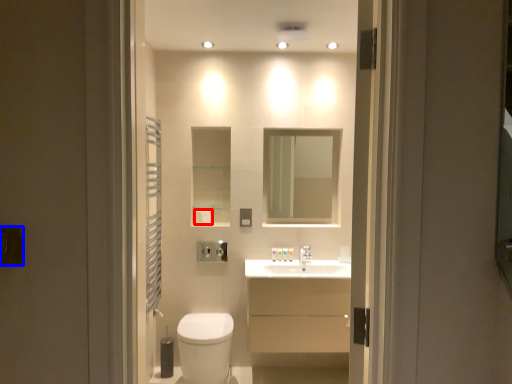
Question: Which point is further to the camera, toilet paper (highlighted by a red box) or electric outlet (highlighted by a blue box)?

Choices:
 (A) toilet paper
 (B) electric outlet

Answer: (A)